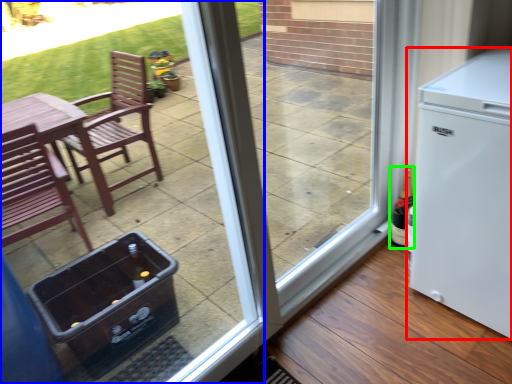
Question: Which object is the farthest from refrigerator (highlighted by a red box)? Choose among these: door (highlighted by a blue box) or bottle (highlighted by a green box).

Choices:
 (A) door
 (B) bottle

Answer: (A)